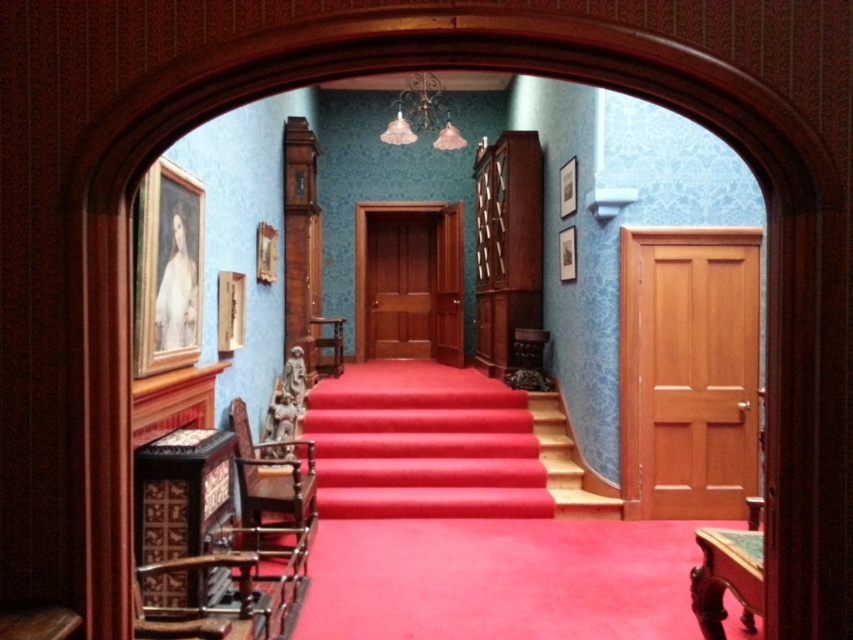
In the scene shown: Is velvet red carpet at center closer to camera compared to wooden at center?

That is False.

Image resolution: width=853 pixels, height=640 pixels. What do you see at coordinates (422, 444) in the screenshot? I see `velvet red carpet at center` at bounding box center [422, 444].

At what (x,y) coordinates should I click in order to perform the action: click on velvet red carpet at center. Please return your answer as a coordinate pair (x, y). Looking at the image, I should click on (422, 444).

Where is `velvet red carpet at center`? velvet red carpet at center is located at coordinates (422, 444).